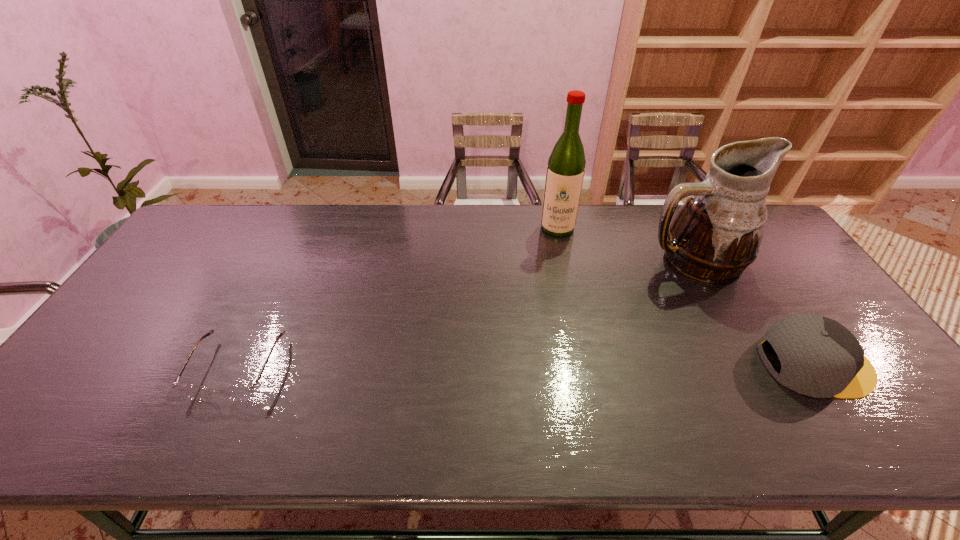
At what (x,y) coordinates should I click in order to perform the action: click on free space on the desktop that is between the shortest object and the cap and is positioned on the label of the liquor. Please return your answer as a coordinate pair (x, y). Looking at the image, I should click on (550, 366).

This screenshot has height=540, width=960. In order to click on free spot on the desktop that is between the leftmost object and the cap and is positioned from the spout of the pitcher in this screenshot , I will do `click(612, 366)`.